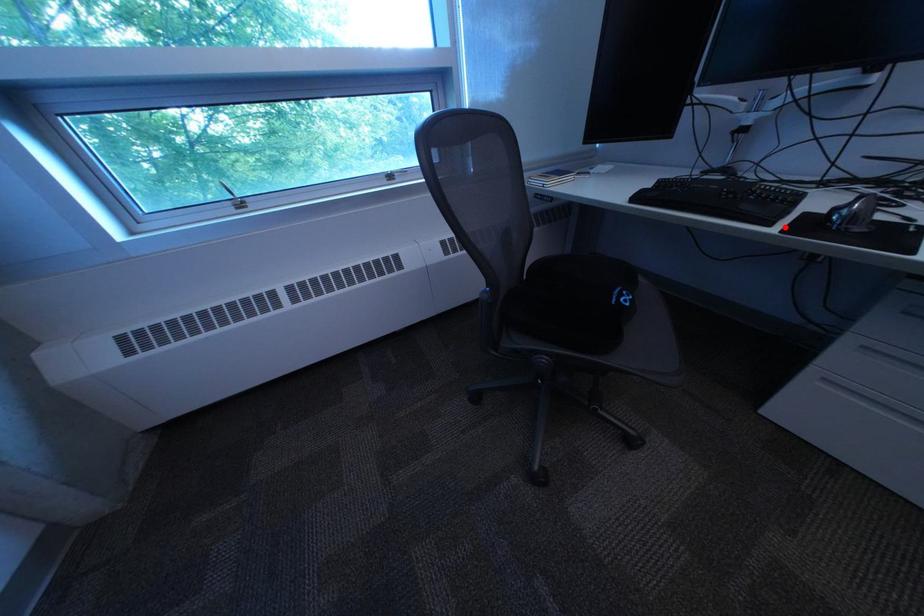
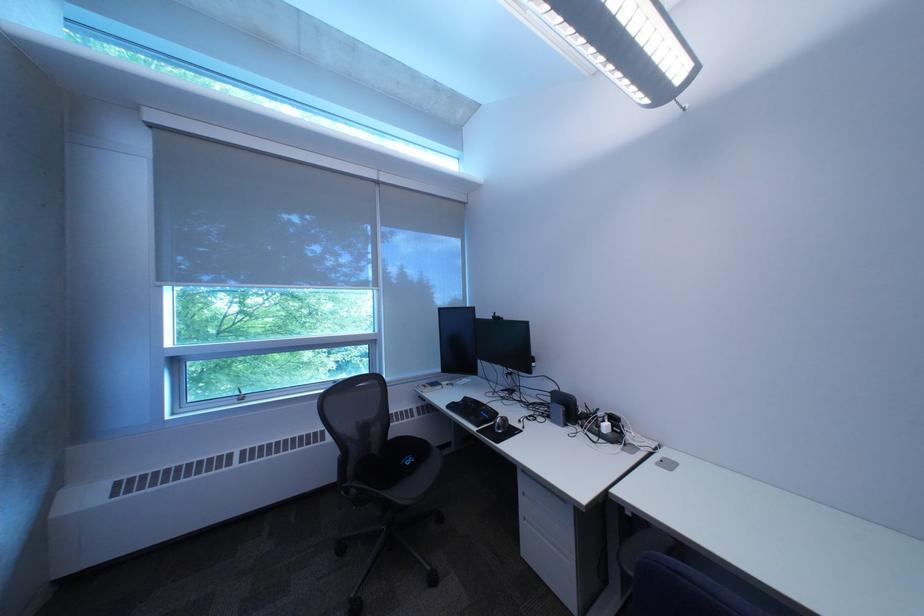
The point at the highlighted location is marked in the first image. Where is the corresponding point in the second image?

(492, 429)